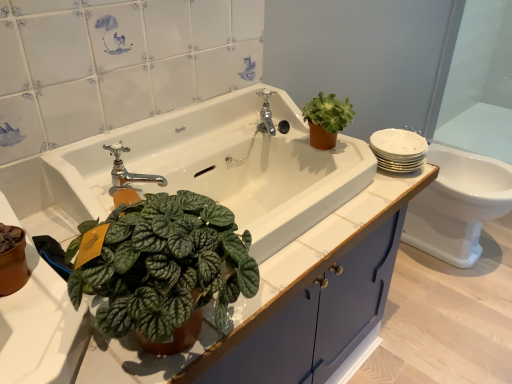
Question: From a real-world perspective, is polished chrome faucet at center, the second tap positioned from the top, located beneath blue matte cabinet at center?

Choices:
 (A) yes
 (B) no

Answer: (B)

Question: From the image's perspective, is polished chrome faucet at center, the 2th tap in the back-to-front sequence, over blue matte cabinet at center?

Choices:
 (A) yes
 (B) no

Answer: (A)

Question: Is polished chrome faucet at center, acting as the first tap starting from the front, further to camera compared to blue matte cabinet at center?

Choices:
 (A) yes
 (B) no

Answer: (A)

Question: Considering the relative sizes of polished chrome faucet at center, acting as the first tap starting from the front, and blue matte cabinet at center in the image provided, is polished chrome faucet at center, acting as the first tap starting from the front, thinner than blue matte cabinet at center?

Choices:
 (A) yes
 (B) no

Answer: (A)

Question: Is polished chrome faucet at center, the second tap positioned from the top, located outside blue matte cabinet at center?

Choices:
 (A) no
 (B) yes

Answer: (B)

Question: From the image's perspective, is white glossy toilet at right above or below green matte succulent at upper right?

Choices:
 (A) above
 (B) below

Answer: (B)

Question: In terms of height, does white glossy toilet at right look taller or shorter compared to green matte succulent at upper right?

Choices:
 (A) short
 (B) tall

Answer: (B)

Question: Is white glossy toilet at right inside the boundaries of green matte succulent at upper right, or outside?

Choices:
 (A) outside
 (B) inside

Answer: (A)

Question: Visually, is white glossy toilet at right positioned to the left or to the right of green matte succulent at upper right?

Choices:
 (A) left
 (B) right

Answer: (B)

Question: In the image, is transparent glass door at upper right on the left side or the right side of polished chrome tap at upper center, which is counted as the 2th tap, starting from the bottom?

Choices:
 (A) left
 (B) right

Answer: (B)

Question: From a real-world perspective, relative to polished chrome tap at upper center, which is the 1th tap in top-to-bottom order, is transparent glass door at upper right vertically above or below?

Choices:
 (A) above
 (B) below

Answer: (B)

Question: From the image's perspective, is transparent glass door at upper right above or below polished chrome tap at upper center, which is the 1th tap in top-to-bottom order?

Choices:
 (A) above
 (B) below

Answer: (A)

Question: Is transparent glass door at upper right in front of or behind polished chrome tap at upper center, which ranks as the second tap in left-to-right order, in the image?

Choices:
 (A) front
 (B) behind

Answer: (B)

Question: Is white glossy sink at center taller or shorter than white glossy toilet at right?

Choices:
 (A) tall
 (B) short

Answer: (B)

Question: Do you think white glossy sink at center is within white glossy toilet at right, or outside of it?

Choices:
 (A) inside
 (B) outside

Answer: (B)